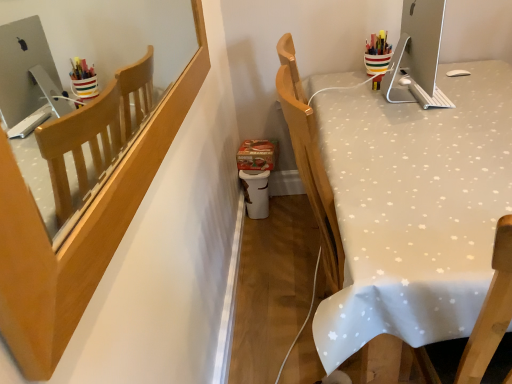
Question: From a real-world perspective, is white fabric-covered desk at right beneath wooden chair back at upper left?

Choices:
 (A) yes
 (B) no

Answer: (A)

Question: Is white fabric-covered desk at right in front of wooden chair back at upper left?

Choices:
 (A) no
 (B) yes

Answer: (A)

Question: From the image's perspective, does white fabric-covered desk at right appear higher than wooden chair back at upper left?

Choices:
 (A) yes
 (B) no

Answer: (B)

Question: Can you confirm if white fabric-covered desk at right is thinner than wooden chair back at upper left?

Choices:
 (A) no
 (B) yes

Answer: (A)

Question: Is white fabric-covered desk at right next to wooden chair back at upper left?

Choices:
 (A) no
 (B) yes

Answer: (A)

Question: Would you say white fabric-covered desk at right contains wooden chair back at upper left?

Choices:
 (A) yes
 (B) no

Answer: (B)

Question: Is wooden chair back at upper left closer to the viewer compared to satin silver monitor at upper right?

Choices:
 (A) no
 (B) yes

Answer: (B)

Question: Can you confirm if wooden chair back at upper left is positioned to the left of satin silver monitor at upper right?

Choices:
 (A) yes
 (B) no

Answer: (A)

Question: Is wooden chair back at upper left facing towards satin silver monitor at upper right?

Choices:
 (A) yes
 (B) no

Answer: (A)

Question: Does wooden chair back at upper left have a greater height compared to satin silver monitor at upper right?

Choices:
 (A) yes
 (B) no

Answer: (B)

Question: Considering the relative sizes of wooden chair back at upper left and satin silver monitor at upper right in the image provided, is wooden chair back at upper left thinner than satin silver monitor at upper right?

Choices:
 (A) yes
 (B) no

Answer: (A)

Question: From the image's perspective, is wooden chair back at upper left above satin silver monitor at upper right?

Choices:
 (A) yes
 (B) no

Answer: (B)

Question: Is satin silver monitor at upper right facing away from wooden chair back at upper left?

Choices:
 (A) yes
 (B) no

Answer: (B)